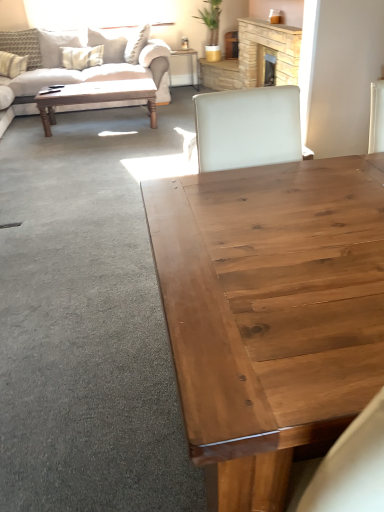
Question: Is beige fabric couch at upper left smaller than white textured pillow at upper left, which ranks as the 3th pillow in left-to-right order?

Choices:
 (A) no
 (B) yes

Answer: (A)

Question: Does beige fabric couch at upper left have a larger size compared to white textured pillow at upper left, the 1th pillow when ordered from right to left?

Choices:
 (A) yes
 (B) no

Answer: (A)

Question: Does beige fabric couch at upper left have a greater width compared to white textured pillow at upper left, the 1th pillow when ordered from right to left?

Choices:
 (A) no
 (B) yes

Answer: (B)

Question: Is white textured pillow at upper left, which ranks as the 3th pillow in left-to-right order, surrounded by beige fabric couch at upper left?

Choices:
 (A) no
 (B) yes

Answer: (B)

Question: Is beige fabric couch at upper left completely or partially outside of white textured pillow at upper left, which ranks as the 3th pillow in left-to-right order?

Choices:
 (A) no
 (B) yes

Answer: (B)

Question: Is stone fireplace at upper center wider or thinner than white textured pillow at upper left, the 1th pillow when ordered from right to left?

Choices:
 (A) thin
 (B) wide

Answer: (A)

Question: Based on their sizes in the image, would you say stone fireplace at upper center is bigger or smaller than white textured pillow at upper left, which ranks as the 3th pillow in left-to-right order?

Choices:
 (A) small
 (B) big

Answer: (B)

Question: Considering the positions of point (276, 64) and point (54, 62), is point (276, 64) closer or farther from the camera than point (54, 62)?

Choices:
 (A) closer
 (B) farther

Answer: (A)

Question: From the image's perspective, is stone fireplace at upper center located above or below white textured pillow at upper left, which ranks as the 3th pillow in left-to-right order?

Choices:
 (A) above
 (B) below

Answer: (B)

Question: Considering the positions of beige fabric couch at upper left and beige fabric pillow at upper left, the third pillow when ordered from right to left, in the image, is beige fabric couch at upper left wider or thinner than beige fabric pillow at upper left, the third pillow when ordered from right to left,?

Choices:
 (A) thin
 (B) wide

Answer: (B)

Question: Is beige fabric couch at upper left bigger or smaller than beige fabric pillow at upper left, the 1th pillow viewed from the left?

Choices:
 (A) small
 (B) big

Answer: (B)

Question: Relative to beige fabric pillow at upper left, the 1th pillow viewed from the left, is beige fabric couch at upper left in front or behind?

Choices:
 (A) front
 (B) behind

Answer: (A)

Question: Is beige fabric couch at upper left taller or shorter than beige fabric pillow at upper left, the 1th pillow viewed from the left?

Choices:
 (A) tall
 (B) short

Answer: (A)

Question: Considering their positions, is stone fireplace at upper center located in front of or behind wooden desk at center?

Choices:
 (A) front
 (B) behind

Answer: (A)

Question: In terms of height, does stone fireplace at upper center look taller or shorter compared to wooden desk at center?

Choices:
 (A) tall
 (B) short

Answer: (A)